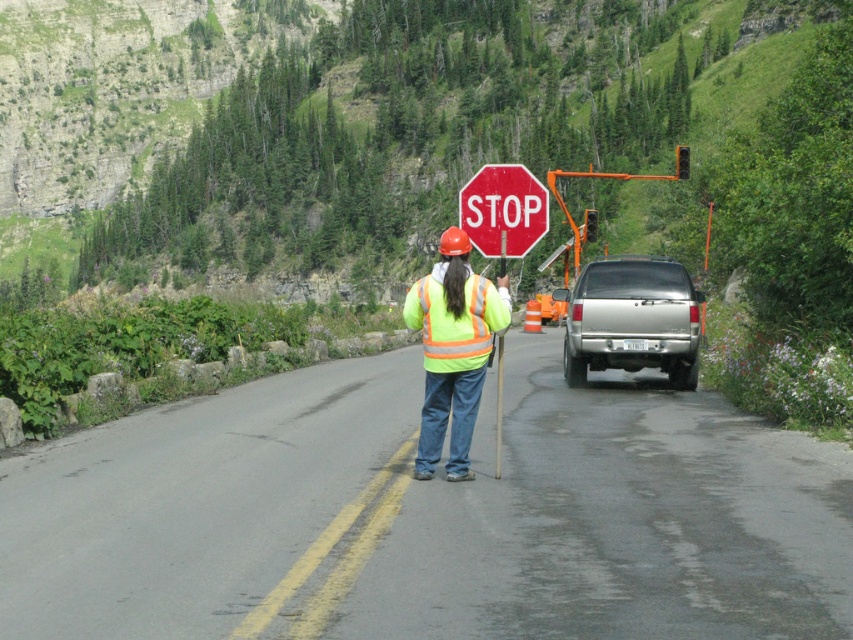
Question: Does silver metallic suv at center have a smaller size compared to red matte stop sign at center?

Choices:
 (A) no
 (B) yes

Answer: (B)

Question: Which of the following is the farthest from the observer?

Choices:
 (A) high-visibility reflective vest at center
 (B) red matte stop sign at center

Answer: (B)

Question: Which object is the farthest from the silver metallic suv at center?

Choices:
 (A) red matte stop sign at center
 (B) high-visibility reflective vest at center
 (C) reflective yellow safety vest at center

Answer: (B)

Question: Which point appears closest to the camera in this image?

Choices:
 (A) (593, 326)
 (B) (206, 600)

Answer: (B)

Question: Observing the image, what is the correct spatial positioning of high-visibility reflective vest at center in reference to red matte stop sign at center?

Choices:
 (A) right
 (B) left

Answer: (B)

Question: Is red matte stop sign at center above high-visibility fabric safety vest at center?

Choices:
 (A) no
 (B) yes

Answer: (B)